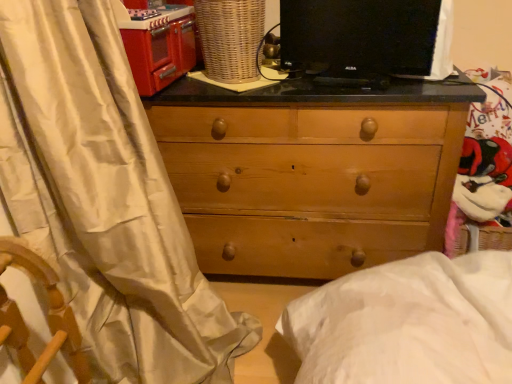
Question: Is black glossy monitor at upper center taller than white satin curtain at left?

Choices:
 (A) yes
 (B) no

Answer: (B)

Question: From a real-world perspective, is black glossy monitor at upper center beneath white satin curtain at left?

Choices:
 (A) no
 (B) yes

Answer: (A)

Question: From a real-world perspective, is black glossy monitor at upper center located higher than white satin curtain at left?

Choices:
 (A) yes
 (B) no

Answer: (A)

Question: Is black glossy monitor at upper center positioned in front of white satin curtain at left?

Choices:
 (A) no
 (B) yes

Answer: (A)

Question: From the image's perspective, would you say black glossy monitor at upper center is positioned over white satin curtain at left?

Choices:
 (A) no
 (B) yes

Answer: (B)

Question: Is black glossy monitor at upper center next to white satin curtain at left and touching it?

Choices:
 (A) yes
 (B) no

Answer: (B)

Question: From the image's perspective, is shiny red oven at upper left beneath white satin curtain at left?

Choices:
 (A) no
 (B) yes

Answer: (A)

Question: Is shiny red oven at upper left positioned behind white satin curtain at left?

Choices:
 (A) no
 (B) yes

Answer: (B)

Question: Is shiny red oven at upper left bigger than white satin curtain at left?

Choices:
 (A) no
 (B) yes

Answer: (A)

Question: Can we say shiny red oven at upper left lies outside white satin curtain at left?

Choices:
 (A) no
 (B) yes

Answer: (B)

Question: Considering the relative sizes of shiny red oven at upper left and white satin curtain at left in the image provided, is shiny red oven at upper left taller than white satin curtain at left?

Choices:
 (A) yes
 (B) no

Answer: (B)

Question: From a real-world perspective, is shiny red oven at upper left on white satin curtain at left?

Choices:
 (A) yes
 (B) no

Answer: (A)

Question: Considering the relative sizes of shiny red oven at upper left and black glossy monitor at upper center in the image provided, is shiny red oven at upper left thinner than black glossy monitor at upper center?

Choices:
 (A) yes
 (B) no

Answer: (B)